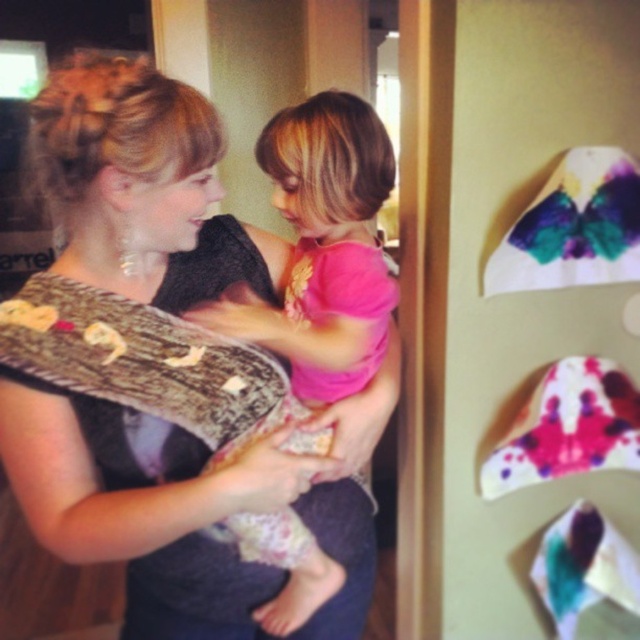
You are a fashion designer observing the scene. You notice the matte black dress at center and the pink fabric at center. Which item is taller when placed side by side?

The matte black dress at center is taller than the pink fabric at center.

Based on the photo, you are a fashion designer observing the scene. You notice the matte black dress at center and the pink fabric at center. Which object would you choose if you need to create a larger garment?

The matte black dress at center is larger in size than the pink fabric at center, so you should choose the matte black dress at center to create a larger garment.